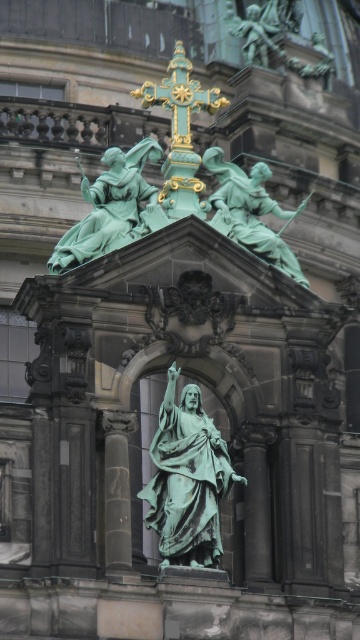
Which of these two, green patinated bronze statue at upper left or goldmetalliccross at upper center, stands taller?

Standing taller between the two is goldmetalliccross at upper center.

Is point (136, 196) positioned before point (177, 118)?

Yes, point (136, 196) is closer to viewer.

Is point (132, 225) closer to viewer compared to point (178, 120)?

Yes, it is in front of point (178, 120).

The width and height of the screenshot is (360, 640). Identify the location of green patinated bronze statue at upper left. (113, 208).

Between green patina statue at center and goldmetalliccross at upper center, which one has less height?

green patina statue at center

Between point (182, 528) and point (186, 202), which one is positioned in front?

Positioned in front is point (182, 528).

The height and width of the screenshot is (640, 360). I want to click on green patina statue at center, so click(186, 480).

Which is behind, point (178, 179) or point (295, 280)?

The point (178, 179) is behind.

Does goldmetalliccross at upper center come behind green patinated statue at upper center?

No, it is in front of green patinated statue at upper center.

Locate an element on the screen. The image size is (360, 640). goldmetalliccross at upper center is located at coordinates (181, 132).